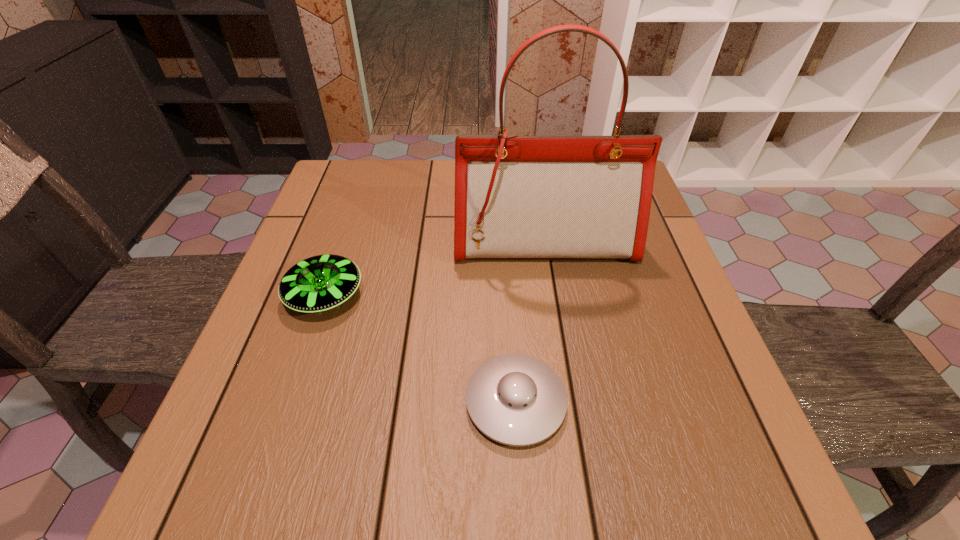
Where is `free space in the image that satisfies the following two spatial constraints: 1. on the back side of the taller saucer; 2. on the left side of the farthest object`? free space in the image that satisfies the following two spatial constraints: 1. on the back side of the taller saucer; 2. on the left side of the farthest object is located at coordinates (342, 245).